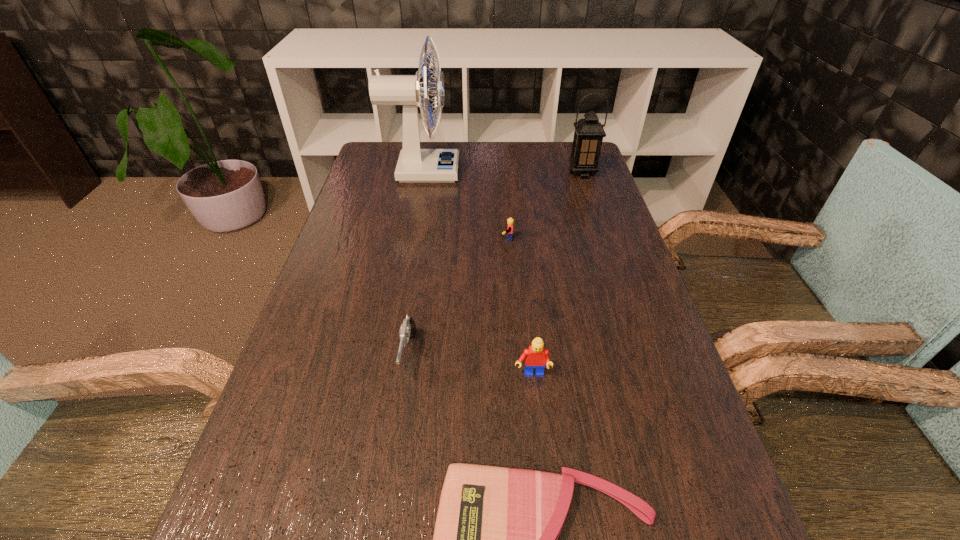
In the image, there is a desktop. Where is `vacant space at the left edge`? The width and height of the screenshot is (960, 540). vacant space at the left edge is located at coordinates tap(276, 390).

The height and width of the screenshot is (540, 960). I want to click on vacant space at the right edge of the desktop, so click(x=624, y=238).

This screenshot has width=960, height=540. In order to click on free spot between the gun and the fourth nearest object in this screenshot , I will do `click(455, 297)`.

I want to click on blank region between the tallest object and the second tallest object, so coord(502,172).

This screenshot has height=540, width=960. What are the coordinates of `empty space between the lantern and the gun` in the screenshot? It's located at (495, 264).

Where is `free space between the second tallest object and the third farthest object`? This screenshot has height=540, width=960. free space between the second tallest object and the third farthest object is located at coordinates 542,206.

Locate an element on the screen. The image size is (960, 540). empty space between the gun and the second tallest object is located at coordinates (495, 264).

Image resolution: width=960 pixels, height=540 pixels. Find the location of `empty location between the tallest object and the fourth nearest object`. empty location between the tallest object and the fourth nearest object is located at coordinates (463, 205).

Where is `empty space that is in between the fan and the rightmost object`? This screenshot has width=960, height=540. empty space that is in between the fan and the rightmost object is located at coordinates (502, 172).

What are the coordinates of `object that stands as the fourth closest to the fourth nearest object` in the screenshot? It's located at (536, 356).